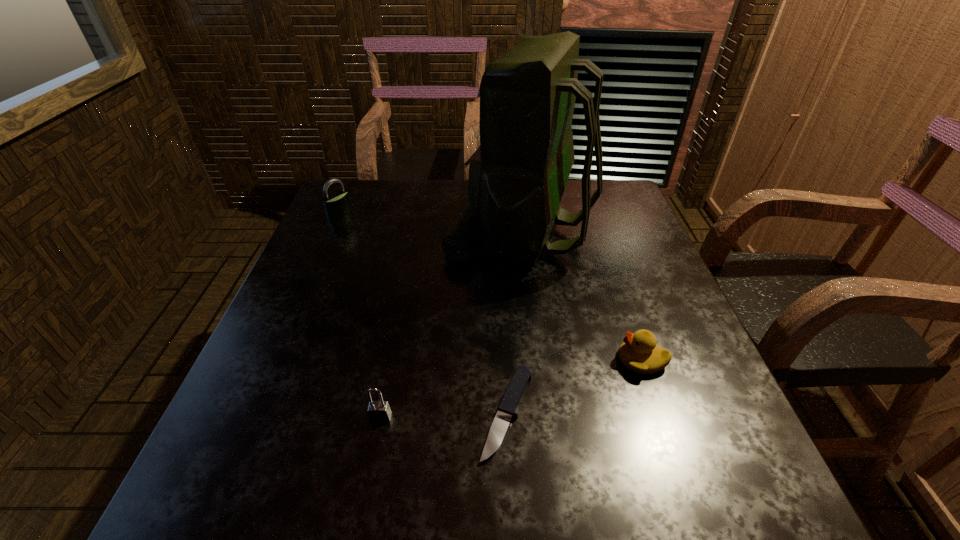
Where is `empty space between the backpack and the steak knife`? empty space between the backpack and the steak knife is located at coordinates (514, 322).

The width and height of the screenshot is (960, 540). Find the location of `empty space between the taller padlock and the duckling`. empty space between the taller padlock and the duckling is located at coordinates (491, 287).

In order to click on free area in between the shortest object and the shorter padlock in this screenshot , I will do `click(444, 415)`.

This screenshot has width=960, height=540. I want to click on free area in between the duckling and the shortest object, so click(x=574, y=386).

I want to click on empty space between the steak knife and the duckling, so click(x=574, y=386).

In order to click on empty location between the duckling and the shortest object in this screenshot , I will do `click(574, 386)`.

The image size is (960, 540). Identify the location of free space between the farther padlock and the backpack. (430, 224).

You are a GUI agent. You are given a task and a screenshot of the screen. Output one action in this format:
    pyautogui.click(x=<x>, y=<y>)
    Task: Click on the free space between the right padlock and the tallest object
    The image size is (960, 540).
    Given the screenshot: What is the action you would take?
    pos(450,324)

Identify which object is the third closest to the tallest object. Please provide its 2D coordinates. Your answer should be formatted as a tuple, i.e. [(x, y)], where the tuple contains the x and y coordinates of a point satisfying the conditions above.

[(336, 206)]

Identify which object is located as the fourth nearest to the shorter padlock. Please provide its 2D coordinates. Your answer should be formatted as a tuple, i.e. [(x, y)], where the tuple contains the x and y coordinates of a point satisfying the conditions above.

[(336, 206)]